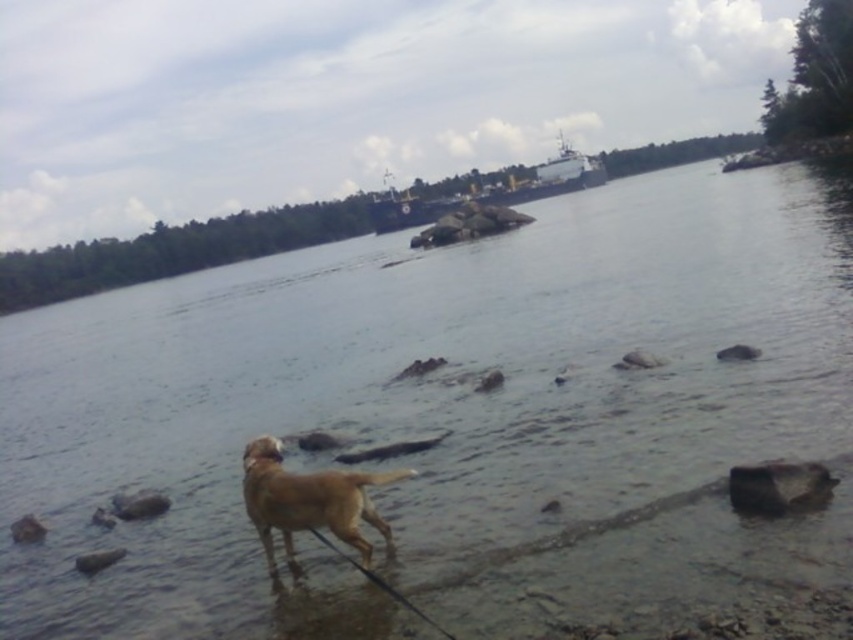
Question: Is golden fur dog at lower center above metallic gray ship at center?

Choices:
 (A) yes
 (B) no

Answer: (B)

Question: Which of the following is the closest to the observer?

Choices:
 (A) golden fur dog at lower center
 (B) metallic gray ship at center

Answer: (A)

Question: Does golden fur dog at lower center lie in front of metallic gray ship at center?

Choices:
 (A) yes
 (B) no

Answer: (A)

Question: Can you confirm if gray smooth rock at lower right is positioned above gray rock at lower left?

Choices:
 (A) no
 (B) yes

Answer: (B)

Question: Which of the following is the closest to the observer?

Choices:
 (A) metallic gray ship at center
 (B) gray rock at lower left
 (C) gray smooth rock at lower right

Answer: (C)

Question: Which object appears farthest from the camera in this image?

Choices:
 (A) gray rock at lower left
 (B) metallic gray ship at center

Answer: (B)